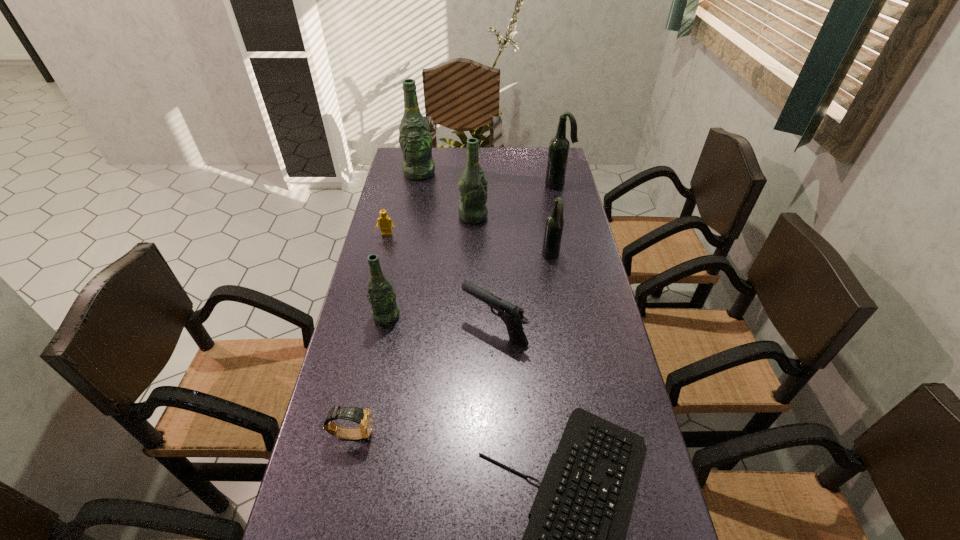
You are a GUI agent. You are given a task and a screenshot of the screen. Output one action in this format:
    pyautogui.click(x=<x>, y=<y>)
    Task: Click on the tallest beer bottle
    The width and height of the screenshot is (960, 540).
    Given the screenshot: What is the action you would take?
    pyautogui.click(x=415, y=139)

Identify the location of the tallest object. (415, 139).

Where is `the second smallest green beer bottle`? The width and height of the screenshot is (960, 540). the second smallest green beer bottle is located at coordinates pyautogui.click(x=472, y=186).

Where is `the rightmost green beer bottle`? the rightmost green beer bottle is located at coordinates (472, 186).

Find the location of a particular element. the farther dark beer bottle is located at coordinates [559, 146].

Find the location of a particular element. This screenshot has width=960, height=540. the fourth farthest beer bottle is located at coordinates (554, 224).

Image resolution: width=960 pixels, height=540 pixels. I want to click on the fifth farthest object, so click(554, 224).

I want to click on the nearest green beer bottle, so click(x=384, y=310).

Where is `the smallest green beer bottle`? This screenshot has width=960, height=540. the smallest green beer bottle is located at coordinates (384, 310).

I want to click on black gun, so click(512, 315).